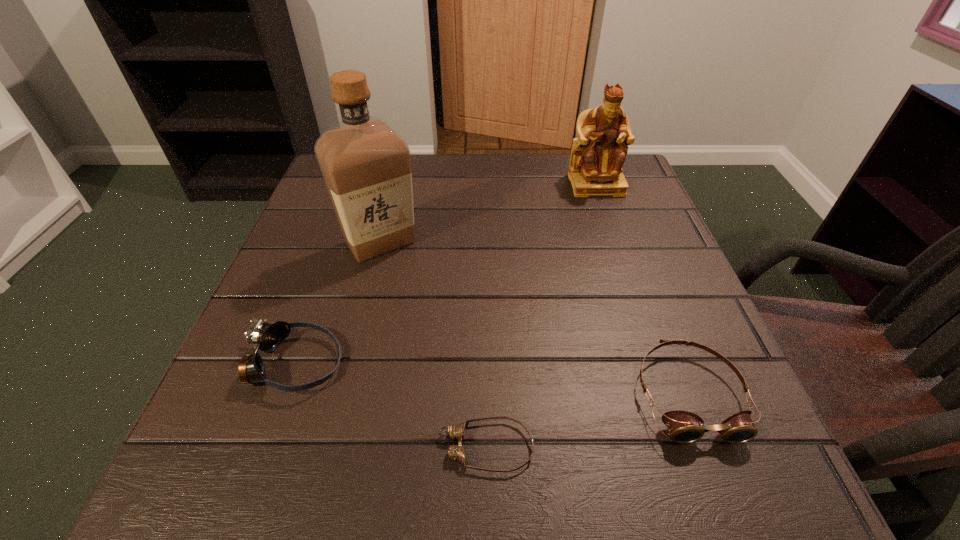
Locate an element on the screen. object present at the far right corner is located at coordinates (598, 154).

The width and height of the screenshot is (960, 540). I want to click on object that is at the near right corner, so (684, 427).

In the image, there is a desktop. Where is `vacant space at the far edge`? The image size is (960, 540). vacant space at the far edge is located at coordinates (567, 191).

Where is `vacant space at the near edge of the desktop`? Image resolution: width=960 pixels, height=540 pixels. vacant space at the near edge of the desktop is located at coordinates (548, 443).

This screenshot has height=540, width=960. Find the location of `vacant region at the left edge of the desktop`. vacant region at the left edge of the desktop is located at coordinates (323, 209).

Locate an element on the screen. free space at the right edge is located at coordinates (680, 292).

Identify the location of blank space at the near right corner of the desktop. This screenshot has width=960, height=540. (756, 494).

Locate an element on the screen. This screenshot has height=540, width=960. vacant point located between the rightmost goggles and the figurine is located at coordinates pos(642,289).

Find the location of a particular element. This screenshot has height=540, width=960. empty space between the rightmost goggles and the shortest goggles is located at coordinates (587, 420).

Identify the location of vacant area that lies between the rightmost goggles and the farthest object. (642, 289).